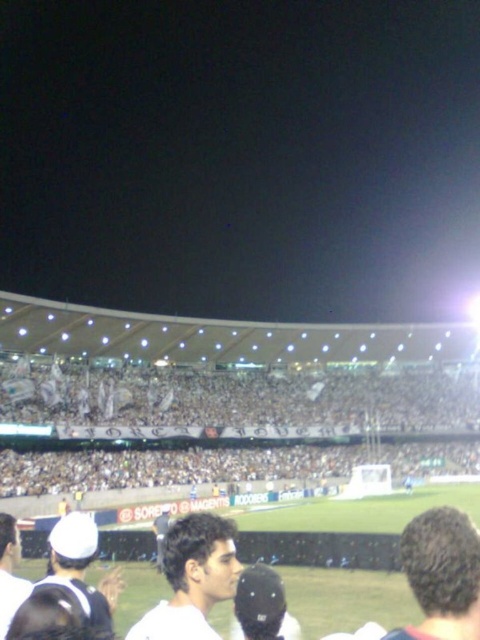
Does white matte cap at lower left have a greater width compared to white matte cap at center?

Yes, white matte cap at lower left is wider than white matte cap at center.

What do you see at coordinates (82, 570) in the screenshot? I see `white matte cap at lower left` at bounding box center [82, 570].

Which is behind, point (106, 637) or point (21, 592)?

The point (21, 592) is behind.

Identify the location of white matte cap at lower left. (82, 570).

Is white matte shirt at center smaller than white matte cap at center?

Actually, white matte shirt at center might be larger than white matte cap at center.

Does white matte shirt at center have a greater height compared to white matte cap at center?

Yes, white matte shirt at center is taller than white matte cap at center.

Identify the location of white matte shirt at center. This screenshot has height=640, width=480. (192, 579).

Is dark brown hair at lower right below white matte cap at center?

Yes.

Who is more distant from viewer, (x=431, y=589) or (x=2, y=536)?

Positioned behind is point (x=2, y=536).

Find the location of a particular element. The image size is (480, 640). dark brown hair at lower right is located at coordinates (442, 573).